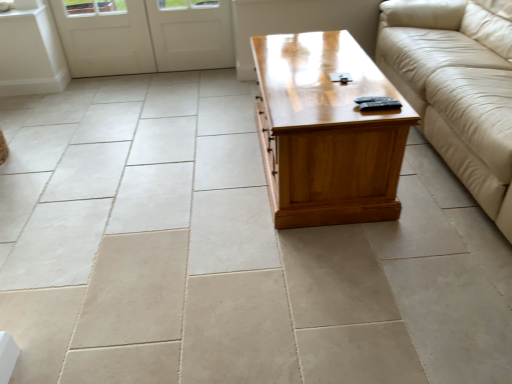
Locate an element on the screen. The width and height of the screenshot is (512, 384). empty space that is ontop of light brown wood coffee table at center (from a real-world perspective) is located at coordinates (309, 74).